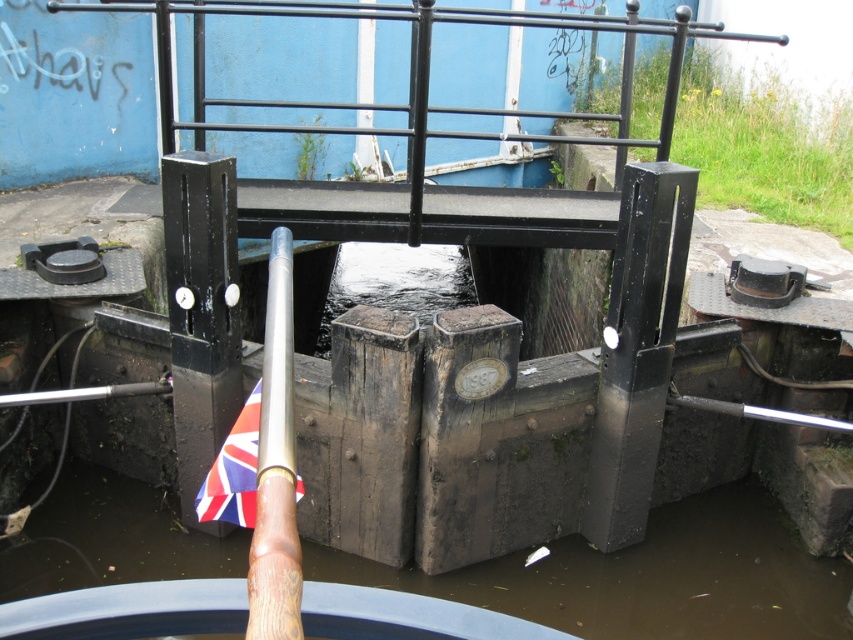
You are standing at the origin point in the image. Which direction should you move to reach the brown wooden paddle at lower center?

The brown wooden paddle at lower center is located at coordinates approximately 0.902 on the x axis and 0.762 on the y axis. Since you are at the origin, you should move towards the positive x and positive y direction to reach it.

You are a boat operator who needs to adjust the lock gate mechanism. You have a brown wooden paddle at lower center and a silver polished wood pole at center. Which object should you use to reach the lock gate mechanism first?

The brown wooden paddle at lower center is located below the silver polished wood pole at center, so you should use the silver polished wood pole at center first to reach the lock gate mechanism since it is higher up.

You are a boat operator who needs to lower the union jack fabric at center to signal an emergency. However, there is a silver polished wood pole at center in the way. Can you lower the flag without moving the pole?

The silver polished wood pole at center is taller than the union jack fabric at center. Since the pole is taller, it might block the flag from being lowered fully. You may need to adjust the flag attachment point or lower it carefully around the pole to avoid obstruction.